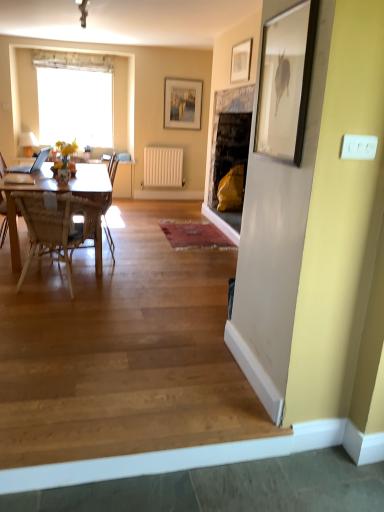
What do you see at coordinates (113, 168) in the screenshot? I see `wooden chair at left, which is the second chair in front-to-back order` at bounding box center [113, 168].

What is the approximate width of matte gold picture frame at upper center, which is counted as the 1th picture frame, starting from the front?

The width of matte gold picture frame at upper center, which is counted as the 1th picture frame, starting from the front, is 1.37 inches.

In order to face white sheer curtain at upper left, should I rotate leftwards or rightwards?

To face it directly, rotate left by 15.015 degrees.

Locate an element on the screen. wooden at lower left is located at coordinates (124, 362).

Is matte gold picture frame at upper center, placed as the second picture frame when sorted from back to front, to the left or to the right of wooden at lower left in the image?

matte gold picture frame at upper center, placed as the second picture frame when sorted from back to front, is to the right of wooden at lower left.

Looking at this image, from the image's perspective, between matte gold picture frame at upper center, placed as the second picture frame when sorted from back to front, and wooden at lower left, who is located below?

From the image's view, wooden at lower left is below.

Can we say matte gold picture frame at upper center, which is counted as the 1th picture frame, starting from the front, lies outside wooden at lower left?

Yes, matte gold picture frame at upper center, which is counted as the 1th picture frame, starting from the front, is outside of wooden at lower left.

Is matte gold picture frame at upper center, which is counted as the 1th picture frame, starting from the front, not close to wooden at lower left?

Yes.

Considering the points (116, 162) and (87, 66), which point is behind, point (116, 162) or point (87, 66)?

Positioned behind is point (87, 66).

Does wooden chair at left, which is the second chair in front-to-back order, come in front of white sheer curtain at upper left?

Yes, wooden chair at left, which is the second chair in front-to-back order, is closer to the camera.

Based on the photo, would you say wooden chair at left, which is the second chair in front-to-back order, is outside white sheer curtain at upper left?

wooden chair at left, which is the second chair in front-to-back order, is positioned outside white sheer curtain at upper left.

Would you consider wooden chair at left, which is the second chair in front-to-back order, to be distant from white sheer curtain at upper left?

That's right, there is a large distance between wooden chair at left, which is the second chair in front-to-back order, and white sheer curtain at upper left.

From the image's perspective, is wooden at lower left on top of woven wood chair at left, positioned as the 2th chair in back-to-front order?

Incorrect, from the image's perspective, wooden at lower left is lower than woven wood chair at left, positioned as the 2th chair in back-to-front order.

Is wooden at lower left not inside woven wood chair at left, marked as the 1th chair in a front-to-back arrangement?

Answer: That's correct, wooden at lower left is outside of woven wood chair at left, marked as the 1th chair in a front-to-back arrangement.

Measure the distance from wooden at lower left to woven wood chair at left, marked as the 1th chair in a front-to-back arrangement.

wooden at lower left is 23.37 inches away from woven wood chair at left, marked as the 1th chair in a front-to-back arrangement.

Between wooden at lower left and woven wood chair at left, positioned as the 2th chair in back-to-front order, which one has smaller size?

Smaller between the two is woven wood chair at left, positioned as the 2th chair in back-to-front order.

Which is more to the right, woven wood chair at left, positioned as the 2th chair in back-to-front order, or matte gold picture frame at upper center, which is counted as the 1th picture frame, starting from the front?

Positioned to the right is matte gold picture frame at upper center, which is counted as the 1th picture frame, starting from the front.

Does point (96, 246) come in front of point (239, 72)?

Yes, it is.

Does woven wood chair at left, marked as the 1th chair in a front-to-back arrangement, have a greater width compared to matte gold picture frame at upper center, placed as the second picture frame when sorted from back to front?

Indeed, woven wood chair at left, marked as the 1th chair in a front-to-back arrangement, has a greater width compared to matte gold picture frame at upper center, placed as the second picture frame when sorted from back to front.

Looking at their sizes, would you say silver metallic picture frame at upper center, the 1th picture frame in the back-to-front sequence, is wider or thinner than woven wood chair at left, positioned as the 2th chair in back-to-front order?

silver metallic picture frame at upper center, the 1th picture frame in the back-to-front sequence, is thinner than woven wood chair at left, positioned as the 2th chair in back-to-front order.

Is silver metallic picture frame at upper center, the second picture frame from the front, looking in the opposite direction of woven wood chair at left, marked as the 1th chair in a front-to-back arrangement?

No, woven wood chair at left, marked as the 1th chair in a front-to-back arrangement, is not at the back of silver metallic picture frame at upper center, the second picture frame from the front.

How many degrees apart are the facing directions of silver metallic picture frame at upper center, which is the 2th picture frame from right to left, and woven wood chair at left, marked as the 1th chair in a front-to-back arrangement?

160 degrees separate the facing orientations of silver metallic picture frame at upper center, which is the 2th picture frame from right to left, and woven wood chair at left, marked as the 1th chair in a front-to-back arrangement.

From the image's perspective, between silver metallic picture frame at upper center, which is the 2th picture frame from right to left, and woven wood chair at left, marked as the 1th chair in a front-to-back arrangement, which one is located above?

silver metallic picture frame at upper center, which is the 2th picture frame from right to left, from the image's perspective.

Which object is positioned more to the left, woven wood chair at left, marked as the 1th chair in a front-to-back arrangement, or white matte radiator at center?

woven wood chair at left, marked as the 1th chair in a front-to-back arrangement, is more to the left.

From a real-world perspective, does woven wood chair at left, marked as the 1th chair in a front-to-back arrangement, sit lower than white matte radiator at center?

Yes.

Is woven wood chair at left, marked as the 1th chair in a front-to-back arrangement, inside the boundaries of white matte radiator at center, or outside?

woven wood chair at left, marked as the 1th chair in a front-to-back arrangement, cannot be found inside white matte radiator at center.

Between matte glass vase at center and silver metallic picture frame at upper center, which is the 2th picture frame from right to left, which one appears on the left side from the viewer's perspective?

From the viewer's perspective, matte glass vase at center appears more on the left side.

Does matte glass vase at center contain silver metallic picture frame at upper center, the second picture frame from the front?

Actually, silver metallic picture frame at upper center, the second picture frame from the front, is outside matte glass vase at center.

From a real-world perspective, which is physically below, matte glass vase at center or silver metallic picture frame at upper center, the 1th picture frame in the back-to-front sequence?

From a 3D spatial view, matte glass vase at center is below.

At what (x,y) coordinates should I click in order to perform the action: click on stair below the matte gold picture frame at upper center, which is counted as the 1th picture frame, starting from the front (from a real-world perspective). Please return your answer as a coordinate pair (x, y). This screenshot has width=384, height=512. Looking at the image, I should click on (124, 362).

Locate an element on the screen. This screenshot has height=512, width=384. the 1st chair below the white sheer curtain at upper left (from the image's perspective) is located at coordinates point(113,168).

Considering their positions, is white matte radiator at center positioned closer to matte gold picture frame at upper center, placed as the second picture frame when sorted from left to right, than matte glass vase at center?

The object closer to matte gold picture frame at upper center, placed as the second picture frame when sorted from left to right, is white matte radiator at center.

From the image, which object appears to be nearer to white sheer curtain at upper left, silver metallic picture frame at upper center, the 1th picture frame in the back-to-front sequence, or matte glass vase at center?

silver metallic picture frame at upper center, the 1th picture frame in the back-to-front sequence, lies closer to white sheer curtain at upper left than the other object.

Considering their positions, is white matte radiator at center positioned closer to white sheer curtain at upper left than matte glass vase at center?

The object closer to white sheer curtain at upper left is white matte radiator at center.

Estimate the real-world distances between objects in this image. Which object is closer to white matte radiator at center, matte gold picture frame at upper center, placed as the second picture frame when sorted from back to front, or wooden at lower left?

matte gold picture frame at upper center, placed as the second picture frame when sorted from back to front, is positioned closer to the anchor white matte radiator at center.

Looking at this image, based on their spatial positions, is silver metallic picture frame at upper center, which is the 1th picture frame from left to right, or woven wood chair at left, marked as the 1th chair in a front-to-back arrangement, closer to white matte radiator at center?

silver metallic picture frame at upper center, which is the 1th picture frame from left to right, is closer to white matte radiator at center.

Based on their spatial positions, is matte glass vase at center or white sheer curtain at upper left further from wooden at lower left?

The object further to wooden at lower left is white sheer curtain at upper left.

Considering their positions, is white sheer curtain at upper left positioned further to silver metallic picture frame at upper center, the second picture frame from the front, than white matte radiator at center?

white sheer curtain at upper left.

Based on their spatial positions, is matte glass vase at center or woven wood chair at left, positioned as the 2th chair in back-to-front order, closer to wooden chair at left, which is the second chair in front-to-back order?

Among the two, matte glass vase at center is located nearer to wooden chair at left, which is the second chair in front-to-back order.

Locate an element on the screen. Image resolution: width=384 pixels, height=512 pixels. vase between wooden at lower left and silver metallic picture frame at upper center, the second picture frame from the front, along the z-axis is located at coordinates (64, 175).

Where is `chair positioned between woven wood chair at left, positioned as the 2th chair in back-to-front order, and silver metallic picture frame at upper center, the 1th picture frame in the back-to-front sequence, from near to far`? The width and height of the screenshot is (384, 512). chair positioned between woven wood chair at left, positioned as the 2th chair in back-to-front order, and silver metallic picture frame at upper center, the 1th picture frame in the back-to-front sequence, from near to far is located at coordinates (113, 168).

Locate an element on the screen. The image size is (384, 512). window between wooden at lower left and silver metallic picture frame at upper center, the second picture frame from the front, in the front-back direction is located at coordinates (74, 98).

Where is `window positioned between wooden chair at left, which is the second chair in front-to-back order, and silver metallic picture frame at upper center, which is the 1th picture frame from left to right, from near to far`? This screenshot has height=512, width=384. window positioned between wooden chair at left, which is the second chair in front-to-back order, and silver metallic picture frame at upper center, which is the 1th picture frame from left to right, from near to far is located at coordinates (74, 98).